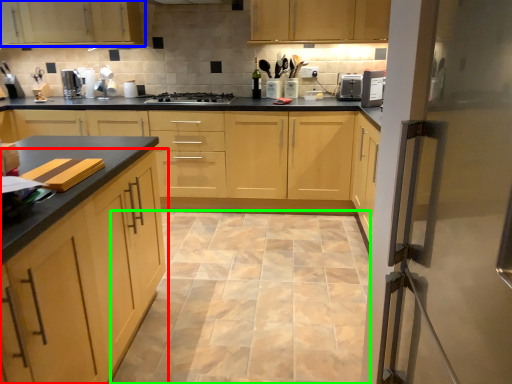
Question: Estimate the real-world distances between objects in this image. Which object is closer to cabinetry (highlighted by a red box), cabinetry (highlighted by a blue box) or ceramic tile (highlighted by a green box)?

Choices:
 (A) cabinetry
 (B) ceramic tile

Answer: (B)